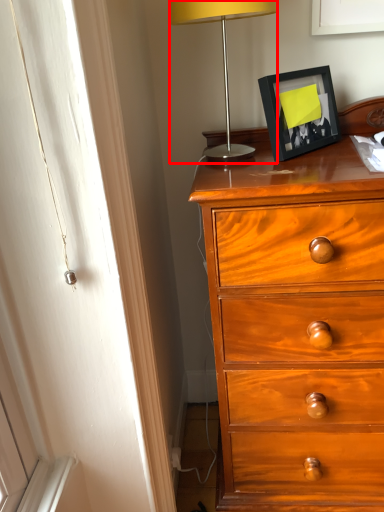
Question: Considering the relative positions of lamp (annotated by the red box) and picture frame in the image provided, where is lamp (annotated by the red box) located with respect to the staircase?

Choices:
 (A) left
 (B) right

Answer: (A)